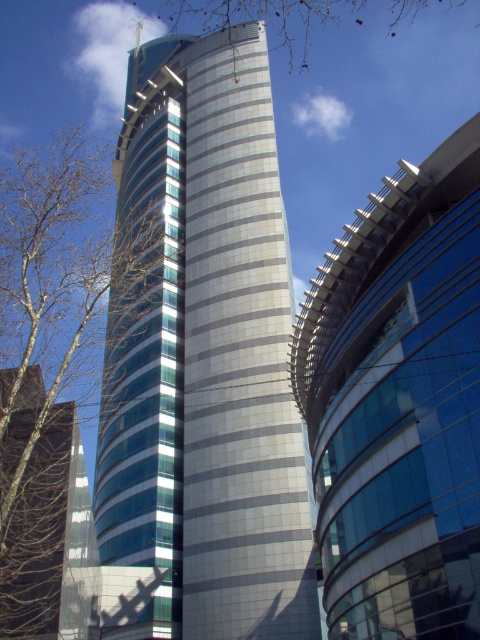
Between silver metallic tower at center and bare branches at left, which one has less height?

silver metallic tower at center

Can you confirm if silver metallic tower at center is shorter than bare branches at left?

Indeed, silver metallic tower at center has a lesser height compared to bare branches at left.

Between point (140, 166) and point (31, 253), which one is positioned behind?

Point (140, 166)

This screenshot has height=640, width=480. I want to click on silver metallic tower at center, so coord(204,355).

Is silver metallic tower at center positioned at the back of brown leafless tree at upper left?

No.

Between silver metallic tower at center and brown leafless tree at upper left, which one appears on the right side from the viewer's perspective?

From the viewer's perspective, brown leafless tree at upper left appears more on the right side.

Measure the distance between point (153, 461) and camera.

A distance of 68.11 meters exists between point (153, 461) and camera.

In order to click on silver metallic tower at center in this screenshot , I will do `click(204, 355)`.

Does bare branches at left appear over brown leafless tree at upper left?

Actually, bare branches at left is below brown leafless tree at upper left.

Which is more to the left, bare branches at left or brown leafless tree at upper left?

bare branches at left

Where is `bare branches at left`? This screenshot has width=480, height=640. bare branches at left is located at coordinates (47, 316).

Identify the location of bare branches at left. This screenshot has height=640, width=480. (47, 316).